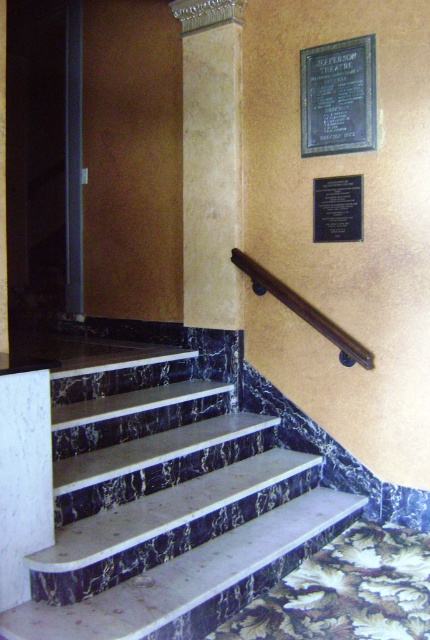
Question: Considering the relative positions of black polished wood sign at upper center and black polished wood plaque at upper center in the image provided, where is black polished wood sign at upper center located with respect to black polished wood plaque at upper center?

Choices:
 (A) below
 (B) above

Answer: (B)

Question: Is black polished wood sign at upper center below black polished wood plaque at upper center?

Choices:
 (A) no
 (B) yes

Answer: (A)

Question: Which point is farther from the camera taking this photo?

Choices:
 (A) (260, 289)
 (B) (104, 436)

Answer: (A)

Question: Which point appears closest to the camera in this image?

Choices:
 (A) (359, 237)
 (B) (70, 390)
 (C) (344, 58)

Answer: (B)

Question: Which of the following is the farthest from the observer?

Choices:
 (A) smooth beige column at center
 (B) marble stairs at center

Answer: (A)

Question: In this image, where is marble stairs at center located relative to smooth beige column at center?

Choices:
 (A) right
 (B) left

Answer: (B)